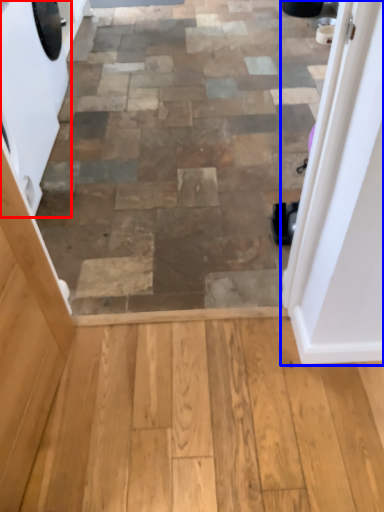
Question: Which of the following is the closest to the observer, washing machine (highlighted by a red box) or door (highlighted by a blue box)?

Choices:
 (A) washing machine
 (B) door

Answer: (B)